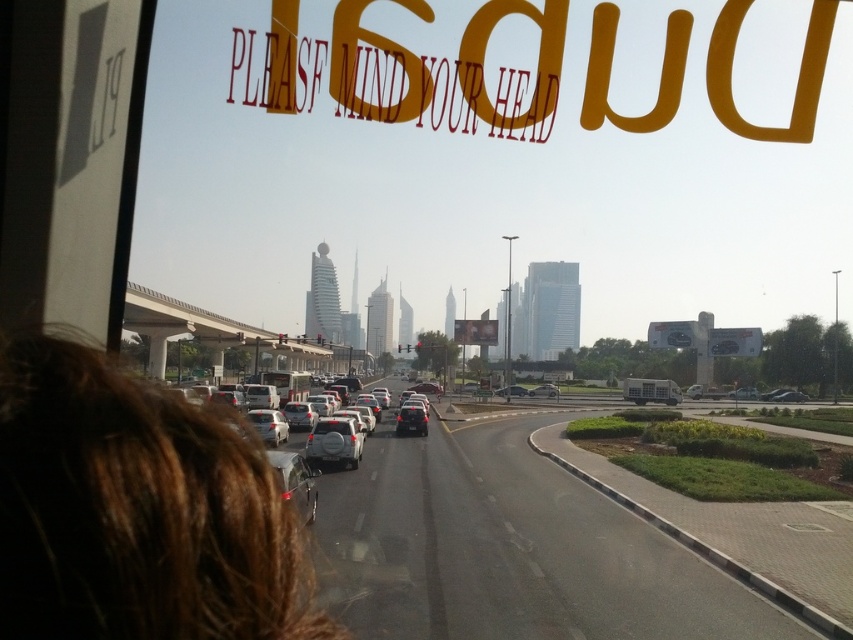
Question: Does satin silver suv at center appear on the right side of shiny silver sedan at center?

Choices:
 (A) yes
 (B) no

Answer: (B)

Question: Which point is closer to the camera taking this photo?

Choices:
 (A) (345, 449)
 (B) (543, 497)
 (C) (415, 403)
 (D) (305, 500)

Answer: (D)

Question: Estimate the real-world distances between objects in this image. Which object is farther from the shiny silver sedan at center?

Choices:
 (A) satin silver suv at center
 (B) metallic gray cars at center

Answer: (A)

Question: Can you confirm if metallic gray cars at center is positioned above shiny silver sedan at center?

Choices:
 (A) yes
 (B) no

Answer: (B)

Question: In this image, where is metallic gray cars at center located relative to shiny silver sedan at center?

Choices:
 (A) above
 (B) below

Answer: (B)

Question: Which point is farther to the camera?

Choices:
 (A) (268, 456)
 (B) (741, 605)
 (C) (318, 458)
 (D) (422, 406)

Answer: (D)